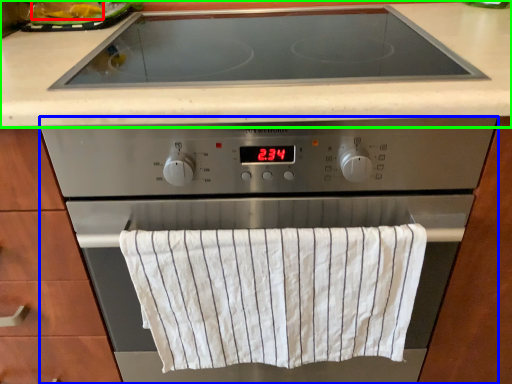
Question: Which object is positioned farthest from food (highlighted by a red box)? Select from home appliance (highlighted by a blue box) and countertop (highlighted by a green box).

Choices:
 (A) home appliance
 (B) countertop

Answer: (A)